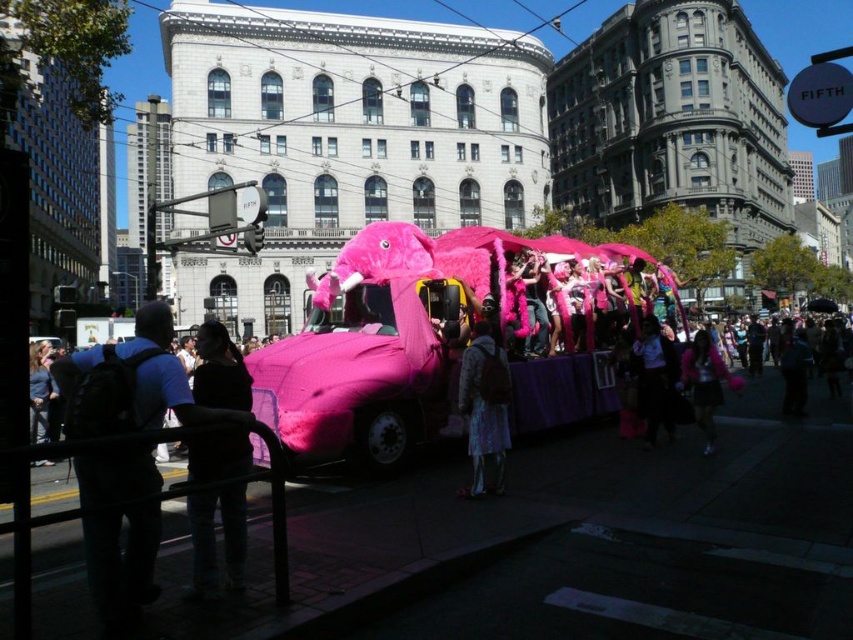
You are a photographer at the parade and want to capture both the fuzzy pink elephant at center and the fluffy pink coat at center in a single photo. Which object should you focus on first to ensure both are in frame?

You should focus on the fuzzy pink elephant at center first since it is larger than the fluffy pink coat at center, ensuring both fit within the frame.

You are a photographer standing in the crowd at the parade. You want to take a photo of both the fluffy pink coat at center and the white matte jacket at center. Which one will appear taller in the photo?

The fluffy pink coat at center will appear taller in the photo because it has a greater height compared to the white matte jacket at center.

You are a spectator standing at the edge of the street during the parade. You notice the fuzzy pink elephant at center and the black fabric at lower left. Which object is positioned to the right of the other?

The fuzzy pink elephant at center is to the right of black fabric at lower left.